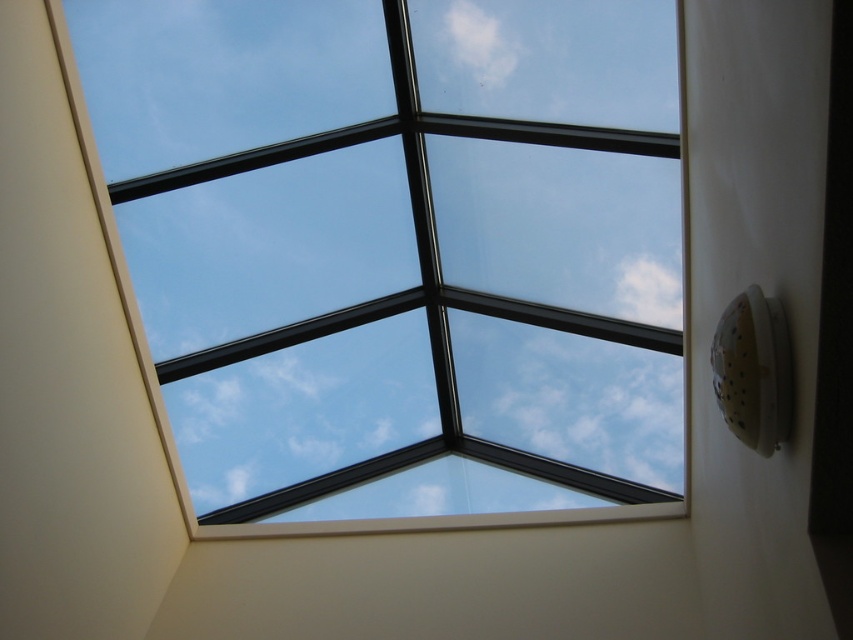
Which of these two, transparent glass skylight at upper center or white fluffy cloud at upper center, stands shorter?

With less height is white fluffy cloud at upper center.

Does transparent glass skylight at upper center appear over white fluffy cloud at upper center?

No.

Who is more distant from viewer, (357, 26) or (457, 49)?

Positioned behind is point (357, 26).

Find the location of a particular element. transparent glass skylight at upper center is located at coordinates (392, 250).